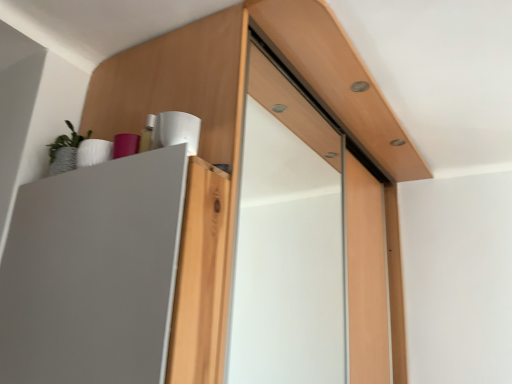
Describe the element at coordinates (243, 81) in the screenshot. I see `matte white dresser at upper left` at that location.

This screenshot has width=512, height=384. I want to click on matte white dresser at upper left, so click(243, 81).

This screenshot has height=384, width=512. Identify the location of matte white dresser at upper left. (243, 81).